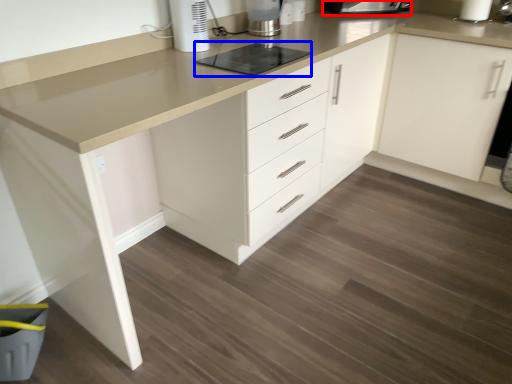
Question: Which point is closer to the camera, kitchen appliance (highlighted by a red box) or appliance (highlighted by a blue box)?

Choices:
 (A) kitchen appliance
 (B) appliance

Answer: (B)